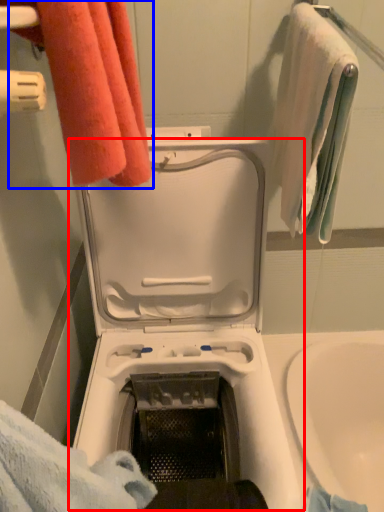
Question: Which point is further to the camera, washing machine (highlighted by a red box) or towel (highlighted by a blue box)?

Choices:
 (A) washing machine
 (B) towel

Answer: (B)